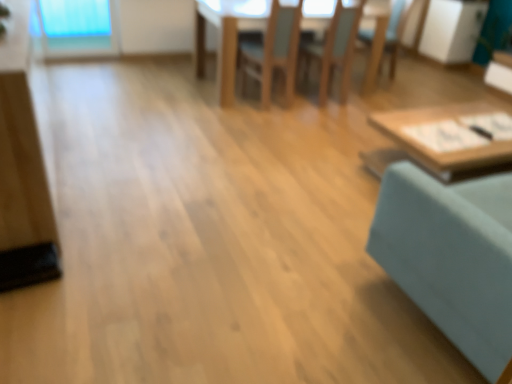
Question: Considering the relative sizes of matte wood dresser at left and wooden chair at center, positioned as the 3th chair in right-to-left order, in the image provided, is matte wood dresser at left bigger than wooden chair at center, positioned as the 3th chair in right-to-left order,?

Choices:
 (A) yes
 (B) no

Answer: (A)

Question: Is matte wood dresser at left positioned with its back to wooden chair at center, which is the 1th chair from left to right?

Choices:
 (A) no
 (B) yes

Answer: (A)

Question: Is matte wood dresser at left to the left of wooden chair at center, positioned as the 3th chair in right-to-left order, from the viewer's perspective?

Choices:
 (A) no
 (B) yes

Answer: (B)

Question: Can you confirm if matte wood dresser at left is smaller than wooden chair at center, positioned as the 3th chair in right-to-left order?

Choices:
 (A) yes
 (B) no

Answer: (B)

Question: From a real-world perspective, is matte wood dresser at left below wooden chair at center, positioned as the 3th chair in right-to-left order?

Choices:
 (A) no
 (B) yes

Answer: (A)

Question: Considering the relative sizes of matte wood dresser at left and wooden chair at center, positioned as the 3th chair in right-to-left order, in the image provided, is matte wood dresser at left taller than wooden chair at center, positioned as the 3th chair in right-to-left order,?

Choices:
 (A) yes
 (B) no

Answer: (B)

Question: Considering the relative sizes of matte wood dresser at left and wooden table at center, which is counted as the first table, starting from the back, in the image provided, is matte wood dresser at left wider than wooden table at center, which is counted as the first table, starting from the back,?

Choices:
 (A) yes
 (B) no

Answer: (B)

Question: Can we say matte wood dresser at left lies outside wooden table at center, the 2th table from the bottom?

Choices:
 (A) yes
 (B) no

Answer: (A)

Question: From the image's perspective, is matte wood dresser at left located above wooden table at center, which is counted as the first table, starting from the back?

Choices:
 (A) no
 (B) yes

Answer: (A)

Question: From a real-world perspective, is matte wood dresser at left on top of wooden table at center, the 2th table from the bottom?

Choices:
 (A) yes
 (B) no

Answer: (A)

Question: Is matte wood dresser at left positioned with its back to wooden table at center, which is counted as the first table, starting from the back?

Choices:
 (A) yes
 (B) no

Answer: (B)

Question: Is matte wood dresser at left positioned far away from wooden table at center, positioned as the 1th table in top-to-bottom order?

Choices:
 (A) no
 (B) yes

Answer: (B)

Question: Does teal fabric swivel chair at right have a smaller size compared to wooden chair at center, positioned as the 3th chair in right-to-left order?

Choices:
 (A) yes
 (B) no

Answer: (B)